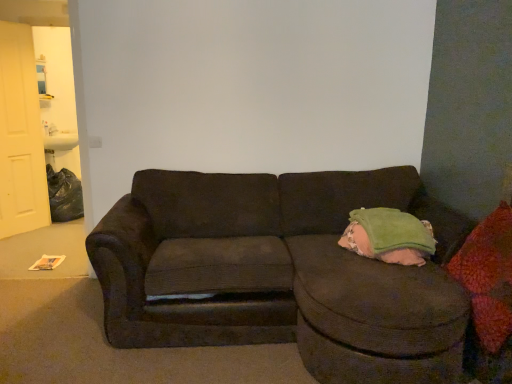
Question: Is green corduroy bean bag chair at right inside red textured throw pillow at right?

Choices:
 (A) no
 (B) yes

Answer: (A)

Question: Is red textured throw pillow at right further to camera compared to green corduroy bean bag chair at right?

Choices:
 (A) yes
 (B) no

Answer: (B)

Question: Is red textured throw pillow at right in contact with green corduroy bean bag chair at right?

Choices:
 (A) yes
 (B) no

Answer: (B)

Question: Is there a large distance between red textured throw pillow at right and green corduroy bean bag chair at right?

Choices:
 (A) no
 (B) yes

Answer: (A)

Question: Considering the relative positions of red textured throw pillow at right and green corduroy bean bag chair at right in the image provided, is red textured throw pillow at right to the left of green corduroy bean bag chair at right from the viewer's perspective?

Choices:
 (A) no
 (B) yes

Answer: (A)

Question: Is red textured throw pillow at right taller or shorter than white matte door at left?

Choices:
 (A) tall
 (B) short

Answer: (B)

Question: Is red textured throw pillow at right inside or outside of white matte door at left?

Choices:
 (A) inside
 (B) outside

Answer: (B)

Question: From a real-world perspective, is red textured throw pillow at right positioned above or below white matte door at left?

Choices:
 (A) below
 (B) above

Answer: (A)

Question: Visually, is red textured throw pillow at right positioned to the left or to the right of white matte door at left?

Choices:
 (A) left
 (B) right

Answer: (B)

Question: From a real-world perspective, is dark corduroy couch at center physically located above or below white matte door at left?

Choices:
 (A) below
 (B) above

Answer: (A)

Question: Considering the positions of point (399, 369) and point (25, 36), is point (399, 369) closer or farther from the camera than point (25, 36)?

Choices:
 (A) farther
 (B) closer

Answer: (B)

Question: Looking at their shapes, would you say dark corduroy couch at center is wider or thinner than white matte door at left?

Choices:
 (A) wide
 (B) thin

Answer: (A)

Question: In terms of size, does dark corduroy couch at center appear bigger or smaller than white matte door at left?

Choices:
 (A) small
 (B) big

Answer: (B)

Question: Is green corduroy bean bag chair at right bigger or smaller than red textured throw pillow at right?

Choices:
 (A) big
 (B) small

Answer: (B)

Question: Is green corduroy bean bag chair at right taller or shorter than red textured throw pillow at right?

Choices:
 (A) tall
 (B) short

Answer: (B)